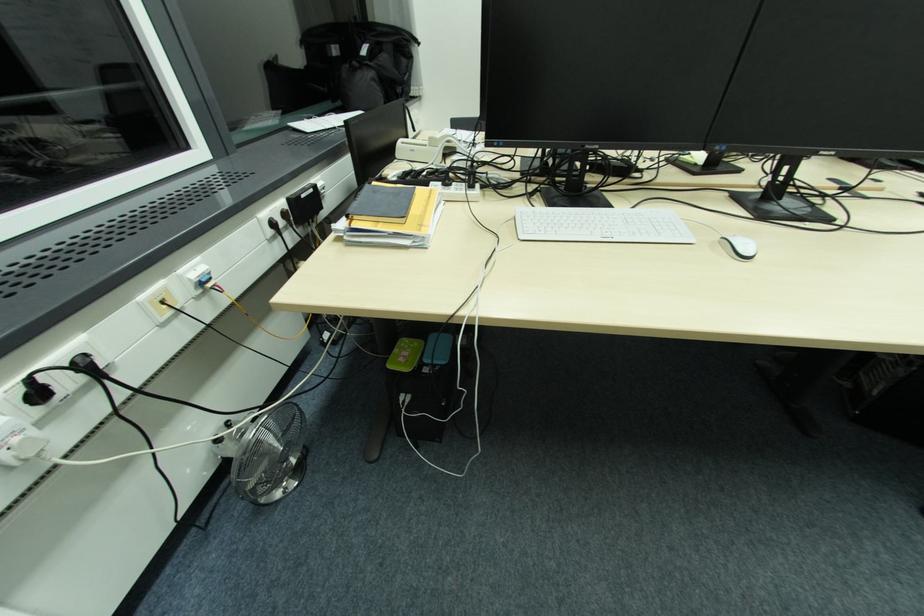
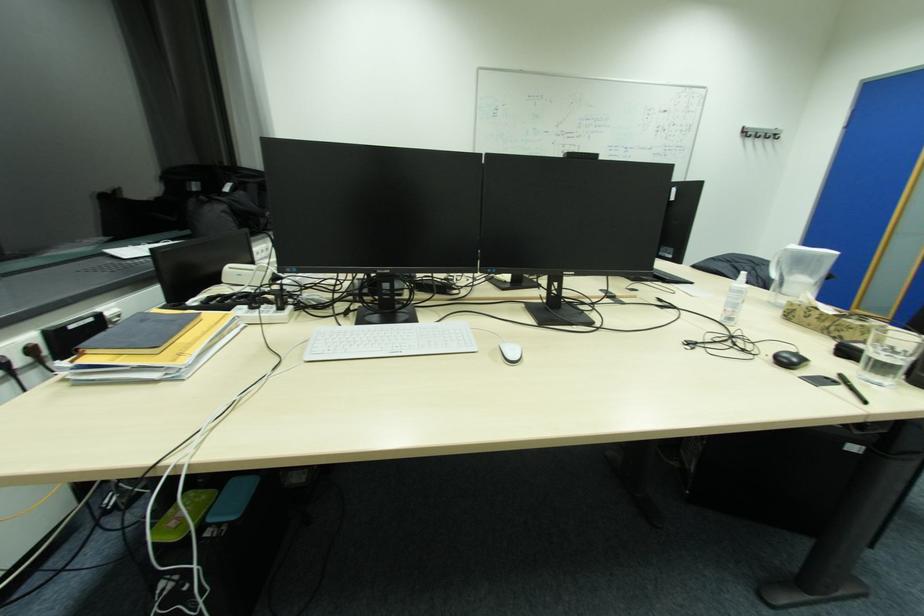
Question: What movement of the cameraman would produce the second image?

Choices:
 (A) Left
 (B) Right
 (C) Forward
 (D) Backward

Answer: (B)